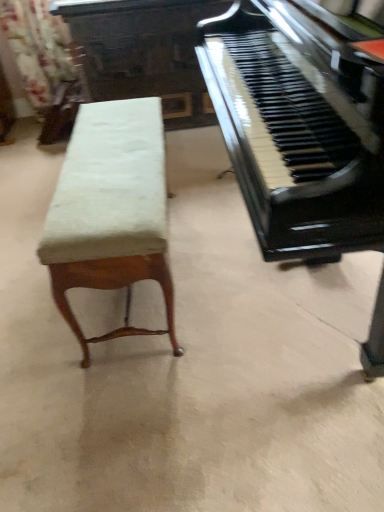
Question: Can you confirm if floral fabric curtain at upper left is bigger than black polished wood piano at right?

Choices:
 (A) no
 (B) yes

Answer: (A)

Question: Is floral fabric curtain at upper left not close to black polished wood piano at right?

Choices:
 (A) no
 (B) yes

Answer: (B)

Question: From a real-world perspective, is floral fabric curtain at upper left over black polished wood piano at right?

Choices:
 (A) yes
 (B) no

Answer: (B)

Question: Could you tell me if floral fabric curtain at upper left is turned towards black polished wood piano at right?

Choices:
 (A) no
 (B) yes

Answer: (A)

Question: Could black polished wood piano at right be considered to be inside floral fabric curtain at upper left?

Choices:
 (A) no
 (B) yes

Answer: (A)

Question: From the image's perspective, is floral fabric curtain at upper left on black polished wood piano at right?

Choices:
 (A) yes
 (B) no

Answer: (A)

Question: Is velvet upholstered bench at left at the back of black polished wood piano at right?

Choices:
 (A) yes
 (B) no

Answer: (B)

Question: Is black polished wood piano at right touching velvet upholstered bench at left?

Choices:
 (A) yes
 (B) no

Answer: (B)

Question: Is black polished wood piano at right positioned beyond the bounds of velvet upholstered bench at left?

Choices:
 (A) no
 (B) yes

Answer: (B)

Question: Is velvet upholstered bench at left surrounded by black polished wood piano at right?

Choices:
 (A) no
 (B) yes

Answer: (A)

Question: Does black polished wood piano at right have a lesser width compared to velvet upholstered bench at left?

Choices:
 (A) no
 (B) yes

Answer: (A)

Question: From the image's perspective, is black polished wood piano at right on velvet upholstered bench at left?

Choices:
 (A) yes
 (B) no

Answer: (A)

Question: Considering the relative sizes of velvet upholstered bench at left and black polished wood piano at right in the image provided, is velvet upholstered bench at left wider than black polished wood piano at right?

Choices:
 (A) yes
 (B) no

Answer: (B)